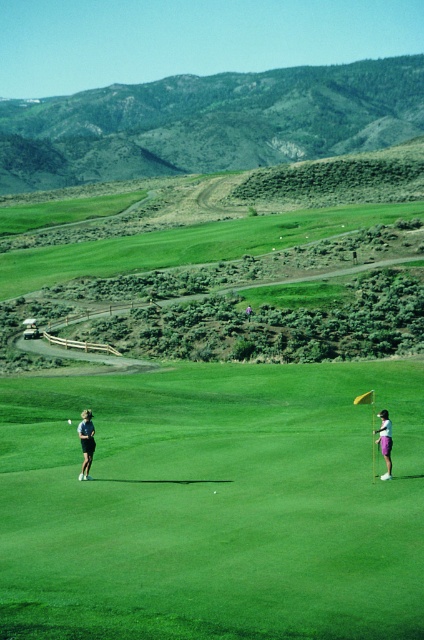
Question: Considering the real-world distances, which object is closest to the green grassy golf course at center?

Choices:
 (A) dark gray pants at left
 (B) purple fabric pants at right

Answer: (B)

Question: Does green grassy golf course at center appear on the left side of dark gray pants at left?

Choices:
 (A) yes
 (B) no

Answer: (B)

Question: From the image, what is the correct spatial relationship of green grassy golf course at center in relation to dark gray pants at left?

Choices:
 (A) left
 (B) right

Answer: (B)

Question: Which object appears farthest from the camera in this image?

Choices:
 (A) purple fabric pants at right
 (B) dark gray pants at left

Answer: (B)

Question: Among these objects, which one is farthest from the camera?

Choices:
 (A) green grassy golf course at center
 (B) dark gray pants at left
 (C) purple fabric pants at right

Answer: (B)

Question: Does dark gray pants at left appear under purple fabric pants at right?

Choices:
 (A) no
 (B) yes

Answer: (A)